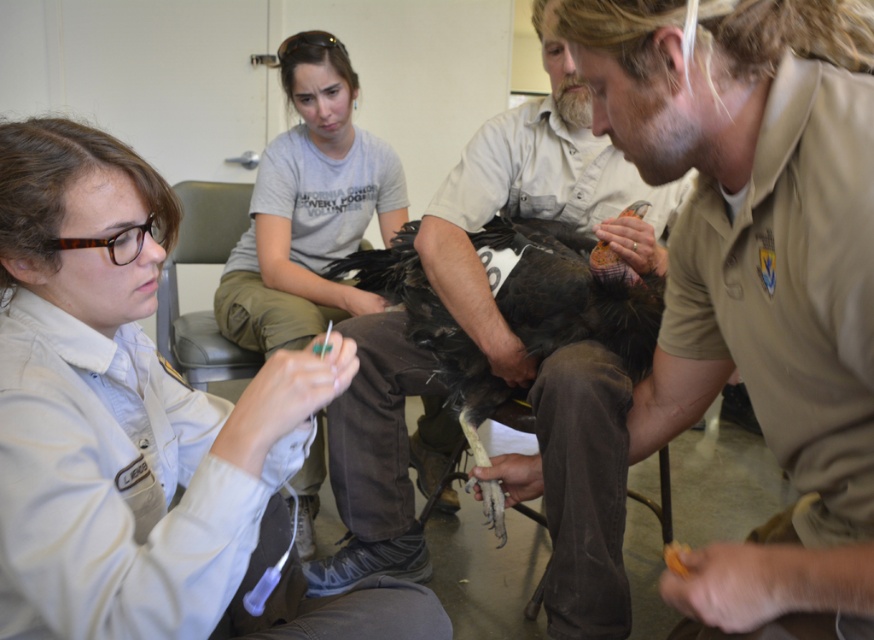
Question: Does brown leather jacket at center appear on the right side of dark brown feathers at center?

Choices:
 (A) no
 (B) yes

Answer: (B)

Question: Is gray cotton shirt at upper center positioned in front of gray leather chair at upper center?

Choices:
 (A) no
 (B) yes

Answer: (B)

Question: Which of these objects is positioned closest to the brown leather jacket at center?

Choices:
 (A) gray cotton shirt at upper center
 (B) dark brown feathers at center

Answer: (B)

Question: Based on their relative distances, which object is farther from the gray cotton shirt at upper center?

Choices:
 (A) brown leather jacket at center
 (B) dark brown feathers at center

Answer: (A)

Question: Is gray cotton shirt at upper center to the right of dark brown feathers at center from the viewer's perspective?

Choices:
 (A) no
 (B) yes

Answer: (A)

Question: Considering the real-world distances, which object is closest to the gray cotton shirt at upper center?

Choices:
 (A) brown leather jacket at center
 (B) dark brown feathers at center

Answer: (B)